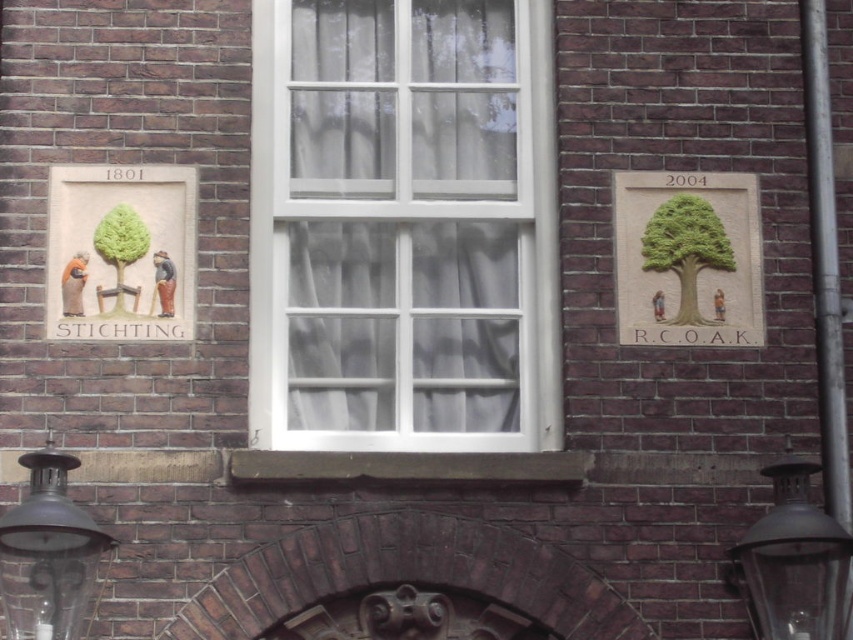
Is white glass window at center below green matte tree at right?

No.

Find the location of a particular element. The image size is (853, 640). white glass window at center is located at coordinates (403, 227).

What do you see at coordinates (403, 227) in the screenshot? This screenshot has height=640, width=853. I see `white glass window at center` at bounding box center [403, 227].

Where is `white glass window at center`? white glass window at center is located at coordinates (403, 227).

Is green stone tree at upper right below matte beige plaque at left?

No.

Between green stone tree at upper right and matte beige plaque at left, which one is positioned higher?

green stone tree at upper right

What do you see at coordinates (688, 259) in the screenshot? The width and height of the screenshot is (853, 640). I see `green stone tree at upper right` at bounding box center [688, 259].

You are a GUI agent. You are given a task and a screenshot of the screen. Output one action in this format:
    pyautogui.click(x=<x>, y=<y>)
    Task: Click on the green stone tree at upper right
    This screenshot has width=853, height=640.
    Given the screenshot: What is the action you would take?
    pyautogui.click(x=688, y=259)

Find the location of a particular element. Image resolution: width=853 pixels, height=640 pixels. green stone tree at upper right is located at coordinates (688, 259).

Which is more to the left, green stone tree at upper right or black glass lamp at lower right?

green stone tree at upper right

At what (x,y) coordinates should I click in order to perform the action: click on green stone tree at upper right. Please return your answer as a coordinate pair (x, y). Image resolution: width=853 pixels, height=640 pixels. Looking at the image, I should click on (688, 259).